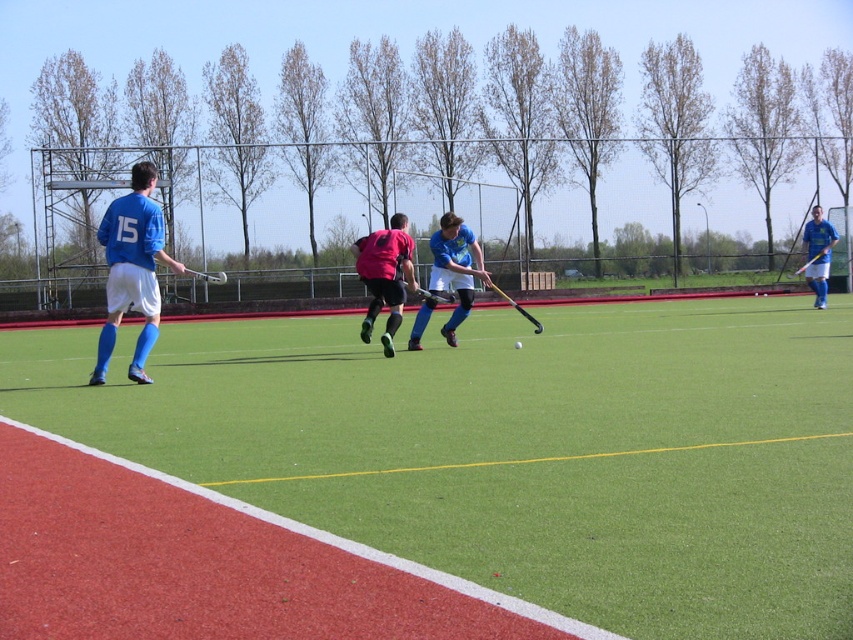
You are a field hockey referee observing the match. You notice two players, the matte pink jersey at center and the matte blue shirt at right. Which player is positioned closer to the right side of the field?

The matte blue shirt at right is positioned closer to the right side of the field since it is to the right of the matte pink jersey at center.

Based on the scene description, can you determine which object is closer to the viewer between the matte blue hockey stick at center and the matte blue shirt at right?

The matte blue hockey stick at center is closer to the viewer because it is in front of the matte blue shirt at right.